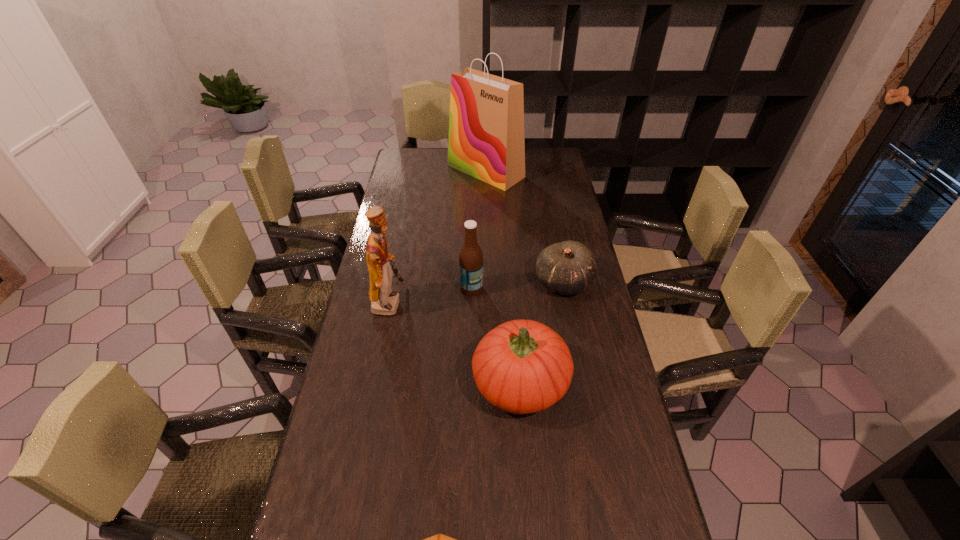
Where is `vacant point located between the pumpkin and the tallest object`? Image resolution: width=960 pixels, height=540 pixels. vacant point located between the pumpkin and the tallest object is located at coordinates (503, 276).

Image resolution: width=960 pixels, height=540 pixels. I want to click on free spot between the shopping bag and the leftmost object, so click(x=438, y=237).

Where is `vacant area that lies between the farther gourd and the fourth shortest object`? This screenshot has width=960, height=540. vacant area that lies between the farther gourd and the fourth shortest object is located at coordinates (517, 285).

What are the coordinates of `free space that is in between the tallest object and the right gourd` in the screenshot? It's located at (524, 227).

Locate an element on the screen. Image resolution: width=960 pixels, height=540 pixels. the closest object to the nutcracker is located at coordinates (471, 258).

Image resolution: width=960 pixels, height=540 pixels. I want to click on object identified as the third closest to the right gourd, so click(x=384, y=301).

The image size is (960, 540). Identify the location of free spot that satisfies the following two spatial constraints: 1. on the back side of the tallest object; 2. on the left side of the beer bottle. (474, 171).

In order to click on vacant space that satisfies the following two spatial constraints: 1. on the front side of the farther gourd; 2. on the front-facing side of the nutcracker in this screenshot , I will do `click(567, 302)`.

Locate an element on the screen. free space that satisfies the following two spatial constraints: 1. on the front side of the beer bottle; 2. on the front-facing side of the leftmost object is located at coordinates (471, 302).

Locate an element on the screen. free spot that satisfies the following two spatial constraints: 1. on the front-facing side of the leftmost object; 2. on the back side of the second nearest object is located at coordinates (373, 382).